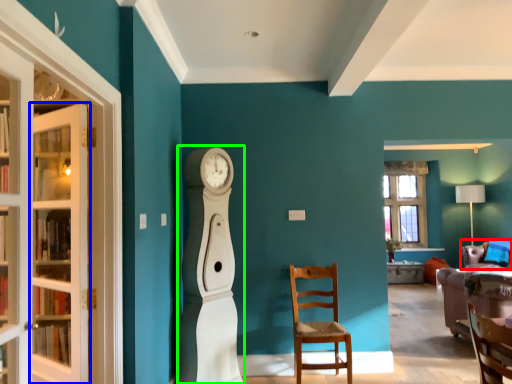
Question: Based on their relative distances, which object is farther from chair (highlighted by a red box)? Choose from door (highlighted by a blue box) and open (highlighted by a green box).

Choices:
 (A) door
 (B) open

Answer: (A)